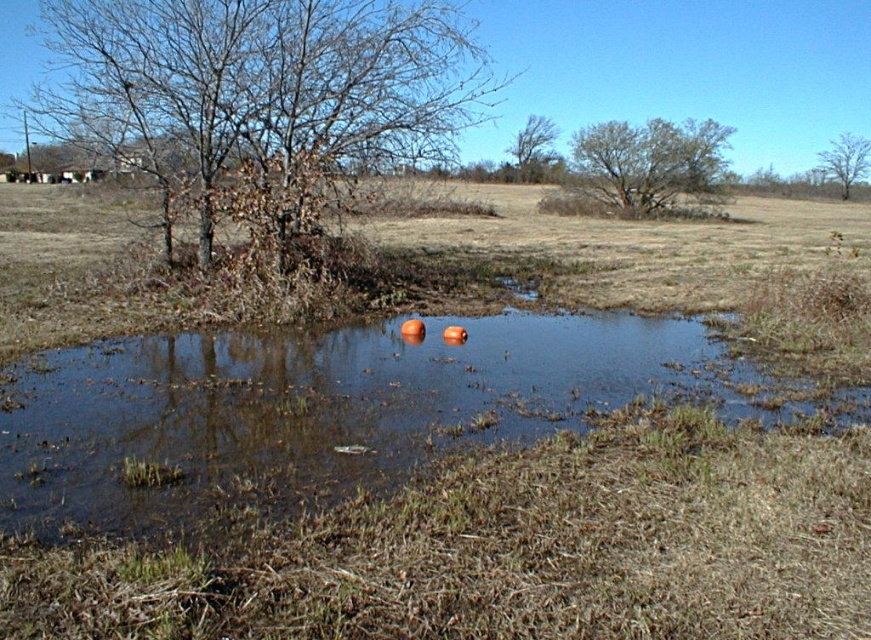
Question: Which object is farther from the camera taking this photo?

Choices:
 (A) brown/dried bark tree at upper left
 (B) brown textured tree at upper center
 (C) translucent water at center

Answer: (B)

Question: Which object is positioned closest to the green leafy tree at upper center?

Choices:
 (A) brown/dried bark tree at upper left
 (B) bare wood tree at upper right

Answer: (A)

Question: Is translucent water at center closer to the viewer compared to brown/dried bark tree at upper left?

Choices:
 (A) no
 (B) yes

Answer: (B)

Question: Is translucent water at center thinner than brown/dried bark tree at upper left?

Choices:
 (A) no
 (B) yes

Answer: (B)

Question: Is translucent water at center smaller than green leafy tree at upper center?

Choices:
 (A) yes
 (B) no

Answer: (A)

Question: Estimate the real-world distances between objects in this image. Which object is farther from the brown textured tree at upper center?

Choices:
 (A) green leafy tree at upper center
 (B) brown/dried bark tree at upper left

Answer: (B)